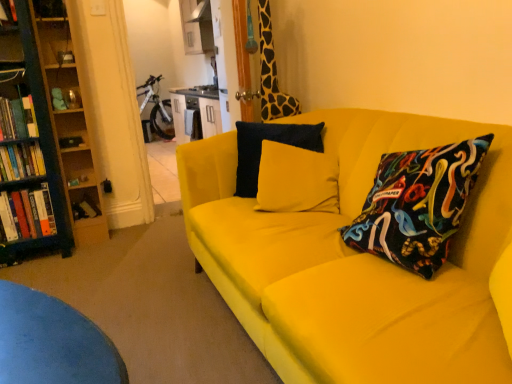
Question: Is wooden bookshelf at left turned away from matte yellow pillow at center?

Choices:
 (A) yes
 (B) no

Answer: (B)

Question: Considering the relative sizes of wooden bookshelf at left and matte yellow pillow at center in the image provided, is wooden bookshelf at left thinner than matte yellow pillow at center?

Choices:
 (A) no
 (B) yes

Answer: (B)

Question: Can you confirm if wooden bookshelf at left is shorter than matte yellow pillow at center?

Choices:
 (A) yes
 (B) no

Answer: (B)

Question: Does wooden bookshelf at left have a greater height compared to matte yellow pillow at center?

Choices:
 (A) yes
 (B) no

Answer: (A)

Question: Is wooden bookshelf at left not within matte yellow pillow at center?

Choices:
 (A) yes
 (B) no

Answer: (A)

Question: Based on their positions, is white glossy bicycle at upper center located to the left or right of giraffe-patterned fabric at upper right?

Choices:
 (A) right
 (B) left

Answer: (B)

Question: Considering the positions of white glossy bicycle at upper center and giraffe-patterned fabric at upper right in the image, is white glossy bicycle at upper center wider or thinner than giraffe-patterned fabric at upper right?

Choices:
 (A) wide
 (B) thin

Answer: (A)

Question: In the image, is white glossy bicycle at upper center positioned in front of or behind giraffe-patterned fabric at upper right?

Choices:
 (A) front
 (B) behind

Answer: (B)

Question: In terms of size, does white glossy bicycle at upper center appear bigger or smaller than giraffe-patterned fabric at upper right?

Choices:
 (A) big
 (B) small

Answer: (A)

Question: Would you say hardcover book at left, the 4th book ordered from the bottom, is inside or outside matte yellow pillow at center?

Choices:
 (A) inside
 (B) outside

Answer: (B)

Question: Is point (3, 109) positioned closer to the camera than point (261, 122)?

Choices:
 (A) closer
 (B) farther

Answer: (B)

Question: From the image's perspective, is hardcover book at left, the 4th book ordered from the bottom, located above or below matte yellow pillow at center?

Choices:
 (A) above
 (B) below

Answer: (A)

Question: Looking at their shapes, would you say hardcover book at left, the 1th book in the top-to-bottom sequence, is wider or thinner than matte yellow pillow at center?

Choices:
 (A) wide
 (B) thin

Answer: (B)

Question: Is white glossy bicycle at upper center wider or thinner than wooden bookshelf at left?

Choices:
 (A) thin
 (B) wide

Answer: (B)

Question: Considering their positions, is white glossy bicycle at upper center located in front of or behind wooden bookshelf at left?

Choices:
 (A) behind
 (B) front

Answer: (A)